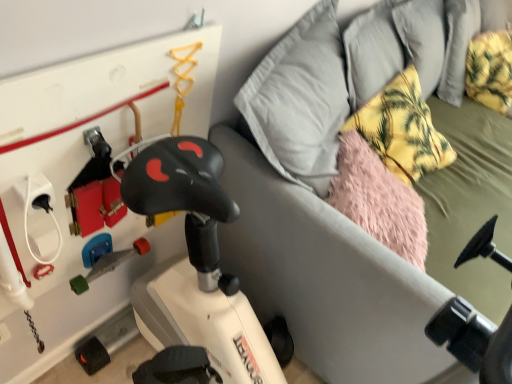
Question: Is point (282, 306) positioned closer to the camera than point (438, 135)?

Choices:
 (A) farther
 (B) closer

Answer: (B)

Question: Considering the positions of white matte exercise bike at lower left and yellow fabric pillow at upper right in the image, is white matte exercise bike at lower left wider or thinner than yellow fabric pillow at upper right?

Choices:
 (A) thin
 (B) wide

Answer: (B)

Question: From the image's perspective, is white matte exercise bike at lower left located above or below yellow fabric pillow at upper right?

Choices:
 (A) below
 (B) above

Answer: (A)

Question: Relative to white matte exercise bike at lower left, is yellow fabric pillow at upper right in front or behind?

Choices:
 (A) front
 (B) behind

Answer: (B)

Question: Is yellow fabric pillow at upper right inside the boundaries of white matte exercise bike at lower left, or outside?

Choices:
 (A) inside
 (B) outside

Answer: (A)

Question: Based on their sizes in the image, would you say yellow fabric pillow at upper right is bigger or smaller than white matte exercise bike at lower left?

Choices:
 (A) big
 (B) small

Answer: (B)

Question: From the image's perspective, is yellow fabric pillow at upper right above or below white matte exercise bike at lower left?

Choices:
 (A) above
 (B) below

Answer: (A)